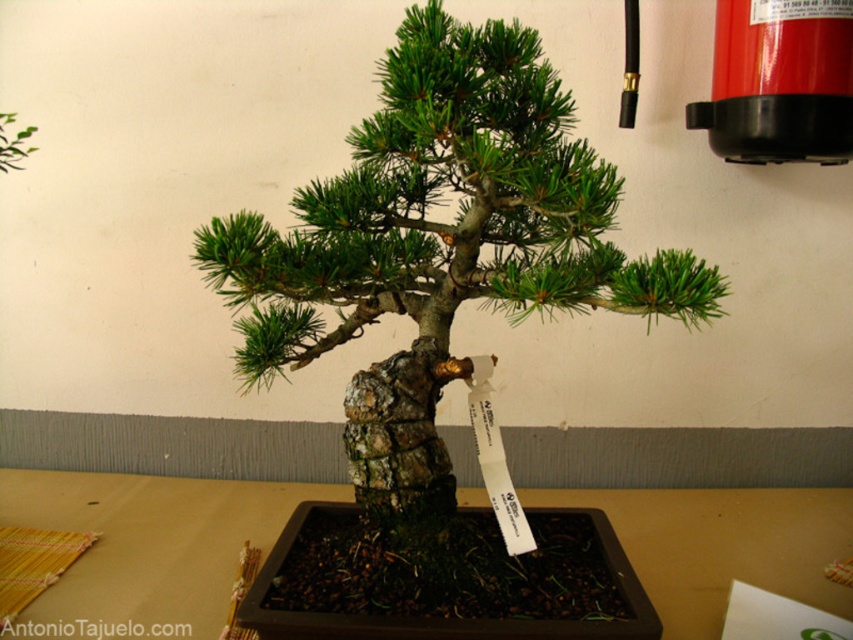
Does point (547, 308) come closer to viewer compared to point (88, 529)?

Yes, point (547, 308) is closer to viewer.

Identify the location of green textured bonsai at center. Image resolution: width=853 pixels, height=640 pixels. (439, 243).

Where is `green textured bonsai at center`? This screenshot has width=853, height=640. green textured bonsai at center is located at coordinates point(439,243).